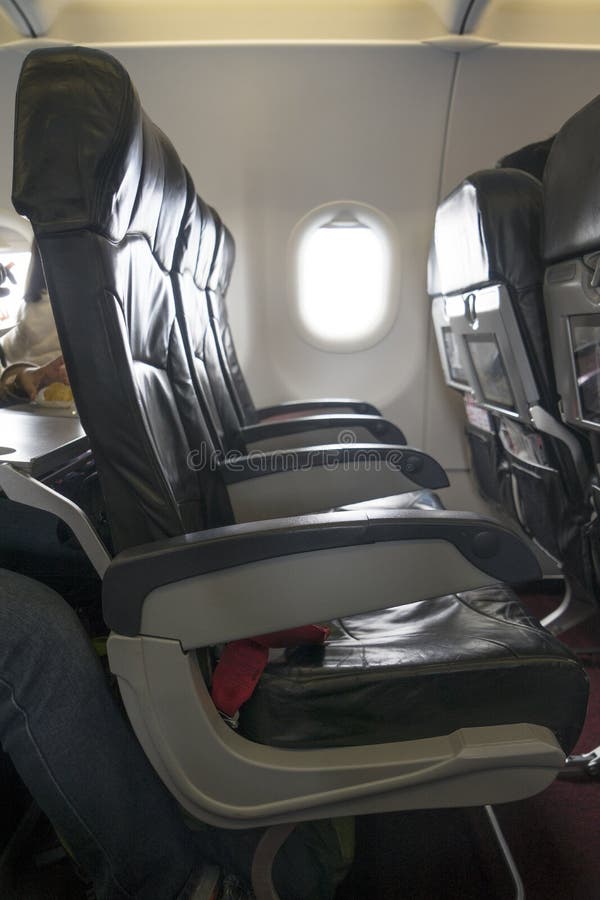
Locate an element on the screen. The image size is (600, 900). chairs is located at coordinates [x=435, y=280], [x=479, y=257], [x=572, y=223], [x=230, y=263], [x=197, y=262], [x=148, y=263].